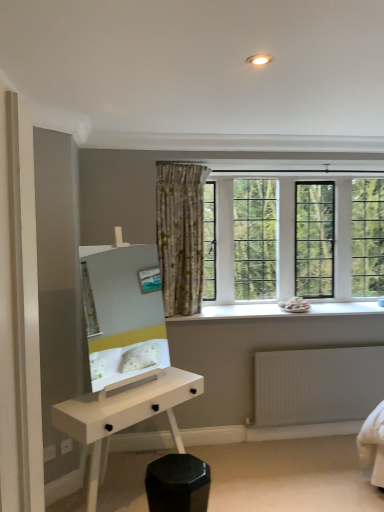
Question: Is black matte hexagonal stool at lower center positioned behind white stone window sill at center?

Choices:
 (A) no
 (B) yes

Answer: (A)

Question: From a real-world perspective, is black matte hexagonal stool at lower center positioned over white stone window sill at center based on gravity?

Choices:
 (A) yes
 (B) no

Answer: (B)

Question: From the image's perspective, is black matte hexagonal stool at lower center over white stone window sill at center?

Choices:
 (A) no
 (B) yes

Answer: (A)

Question: Does black matte hexagonal stool at lower center have a larger size compared to white stone window sill at center?

Choices:
 (A) yes
 (B) no

Answer: (B)

Question: Considering the relative sizes of black matte hexagonal stool at lower center and white stone window sill at center in the image provided, is black matte hexagonal stool at lower center wider than white stone window sill at center?

Choices:
 (A) no
 (B) yes

Answer: (A)

Question: From the image's perspective, relative to white stone window sill at center, is white glossy desk at lower center above or below?

Choices:
 (A) below
 (B) above

Answer: (A)

Question: From a real-world perspective, is white glossy desk at lower center above or below white stone window sill at center?

Choices:
 (A) below
 (B) above

Answer: (A)

Question: Is point (81, 402) positioned closer to the camera than point (226, 309)?

Choices:
 (A) closer
 (B) farther

Answer: (A)

Question: Is white glossy desk at lower center spatially inside white stone window sill at center, or outside of it?

Choices:
 (A) outside
 (B) inside

Answer: (A)

Question: Is white glossy desk at lower center to the left or to the right of white glossy mirror at center in the image?

Choices:
 (A) left
 (B) right

Answer: (B)

Question: Is white glossy desk at lower center situated inside white glossy mirror at center or outside?

Choices:
 (A) inside
 (B) outside

Answer: (B)

Question: From the image's perspective, is white glossy desk at lower center positioned above or below white glossy mirror at center?

Choices:
 (A) above
 (B) below

Answer: (B)

Question: Considering the positions of white glossy desk at lower center and white glossy mirror at center in the image, is white glossy desk at lower center taller or shorter than white glossy mirror at center?

Choices:
 (A) short
 (B) tall

Answer: (A)

Question: From the image's perspective, is white ribbed radiator at lower right located above or below white glossy desk at lower center?

Choices:
 (A) below
 (B) above

Answer: (B)

Question: From their relative heights in the image, would you say white ribbed radiator at lower right is taller or shorter than white glossy desk at lower center?

Choices:
 (A) short
 (B) tall

Answer: (A)